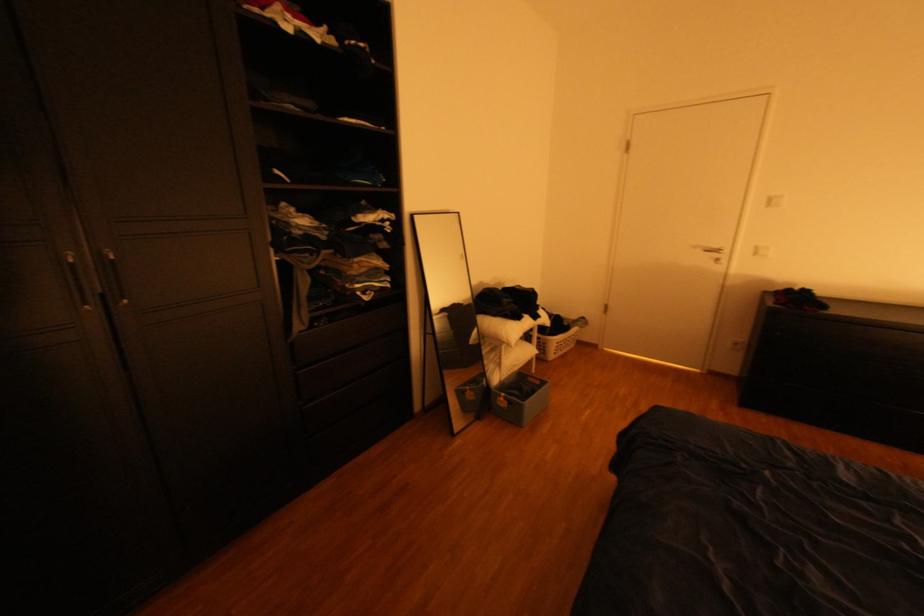
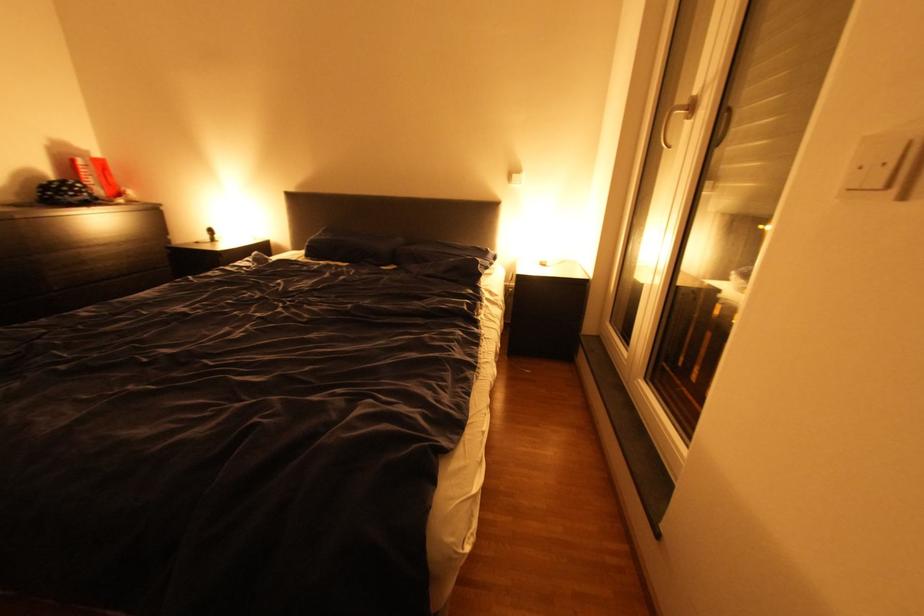
Based on the continuous images, in which direction is the camera rotating?

The rotation direction of the camera is right-down.